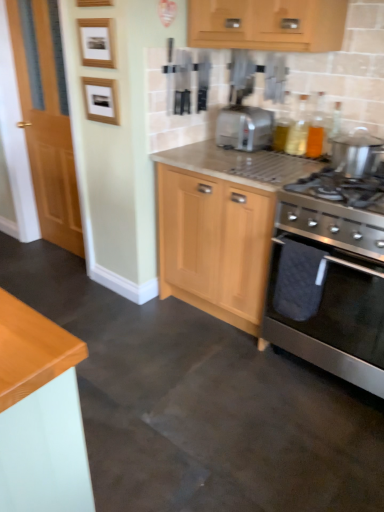
I want to click on free spot above light wood cabinet at center (from a real-world perspective), so click(x=251, y=160).